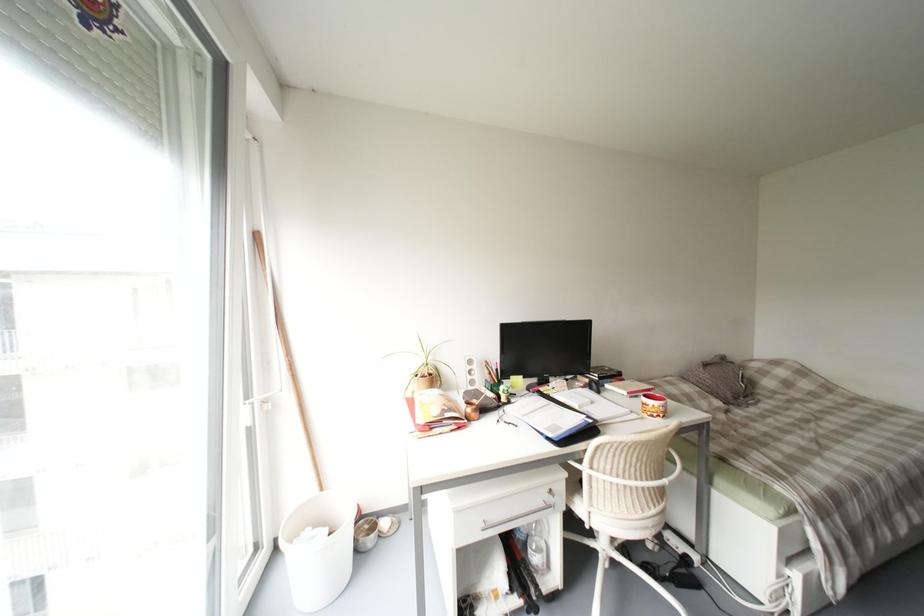
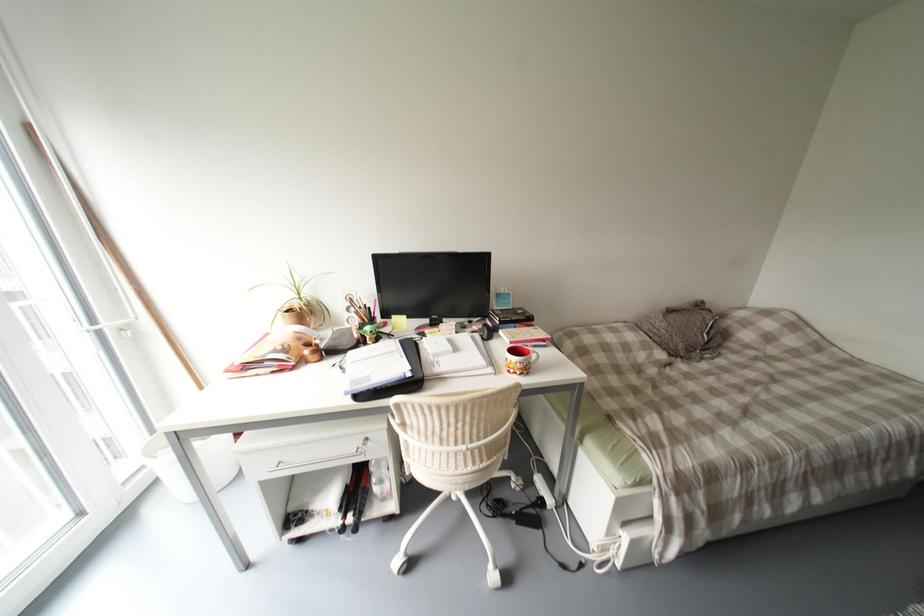
Question: Based on the continuous images, in which direction is the camera rotating? Reply with the corresponding letter.

Choices:
 (A) Left
 (B) Right
 (C) Up
 (D) Down

Answer: (D)